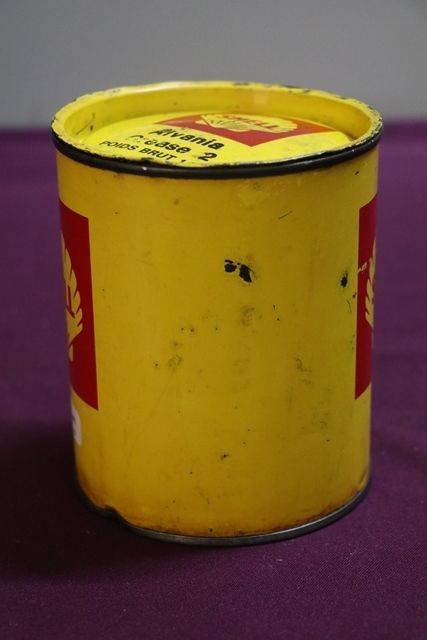
Find the location of a particular element. Image resolution: width=427 pixels, height=640 pixels. scuff marks on canister is located at coordinates (x=243, y=272), (x=229, y=267), (x=343, y=280).